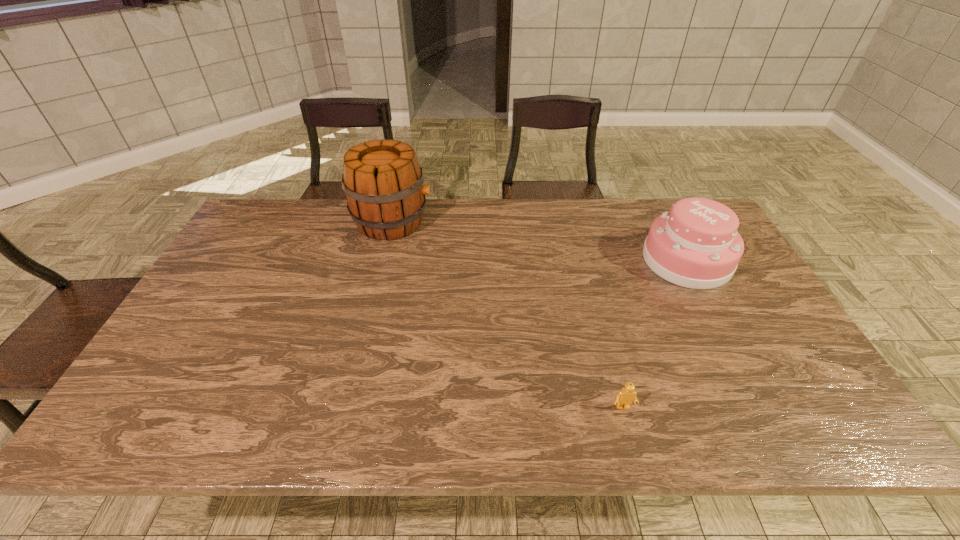
At what (x,y) coordinates should I click in order to perform the action: click on free area in between the leftmost object and the Lego. Please return your answer as a coordinate pair (x, y). The height and width of the screenshot is (540, 960). Looking at the image, I should click on (508, 314).

You are a GUI agent. You are given a task and a screenshot of the screen. Output one action in this format:
    pyautogui.click(x=<x>, y=<y>)
    Task: Click on the free space between the second object from right to left and the second tallest object
    
    Given the screenshot: What is the action you would take?
    pyautogui.click(x=655, y=334)

Where is `unoccupied area between the nearest object and the cider`? unoccupied area between the nearest object and the cider is located at coordinates (508, 314).

This screenshot has height=540, width=960. Find the location of `vacant space in between the nearest object and the birthday cake`. vacant space in between the nearest object and the birthday cake is located at coordinates (655, 334).

This screenshot has height=540, width=960. In order to click on empty space that is in between the second tallest object and the second object from right to left in this screenshot , I will do `click(655, 334)`.

At what (x,y) coordinates should I click in order to perform the action: click on free spot between the tallest object and the nearest object. Please return your answer as a coordinate pair (x, y). The image size is (960, 540). Looking at the image, I should click on (508, 314).

I want to click on free space between the nearest object and the tallest object, so click(508, 314).

Find the location of a particular element. The image size is (960, 540). free space between the leftmost object and the second object from right to left is located at coordinates (508, 314).

At what (x,y) coordinates should I click in order to perform the action: click on the second closest object to the leftmost object. Please return your answer as a coordinate pair (x, y). The width and height of the screenshot is (960, 540). Looking at the image, I should click on (625, 397).

Locate which object ranks in proximity to the cider. Please provide its 2D coordinates. Your answer should be formatted as a tuple, i.e. [(x, y)], where the tuple contains the x and y coordinates of a point satisfying the conditions above.

[(696, 245)]